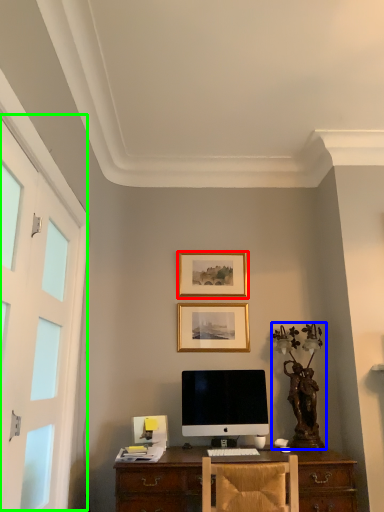
Question: Which is farther away from picture frame (highlighted by a red box)? antique (highlighted by a blue box) or screen door (highlighted by a green box)?

Choices:
 (A) antique
 (B) screen door

Answer: (B)